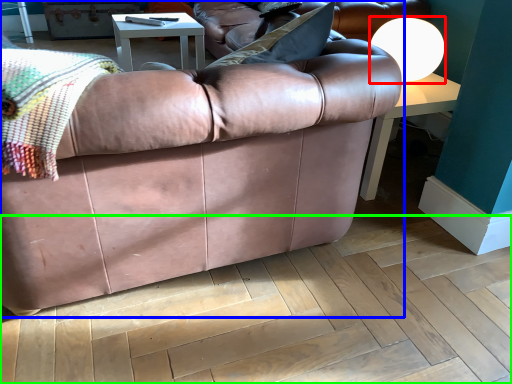
Question: Considering the real-world distances, which object is closest to lamp (highlighted by a red box)? studio couch (highlighted by a blue box) or plywood (highlighted by a green box).

Choices:
 (A) studio couch
 (B) plywood

Answer: (A)